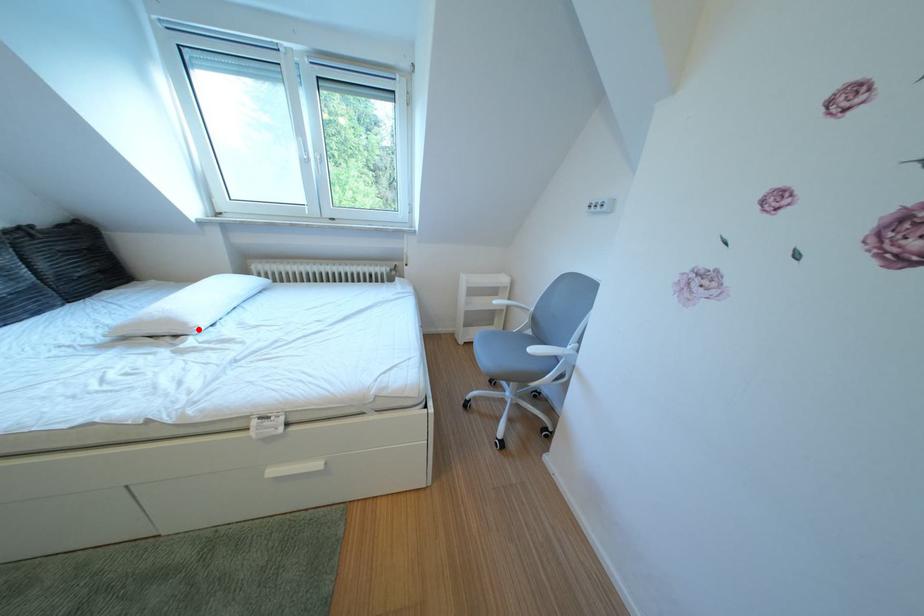
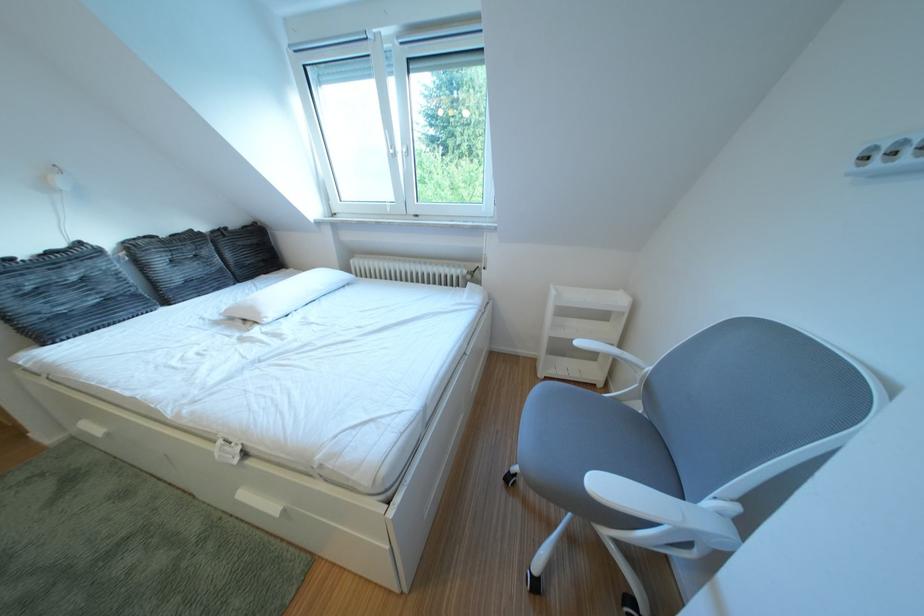
Locate, in the second image, the point that corresponds to the highlighted location in the first image.

(273, 318)